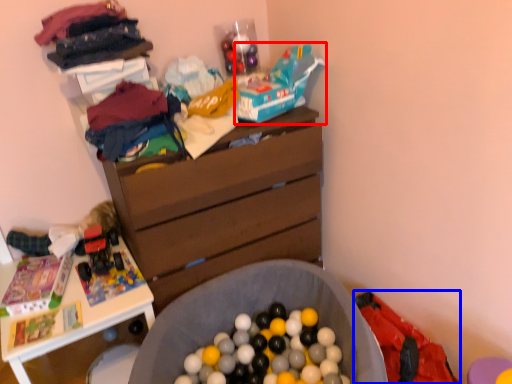
Question: Among these objects, which one is farthest to the camera, toy car (highlighted by a red box) or underclothes (highlighted by a blue box)?

Choices:
 (A) toy car
 (B) underclothes

Answer: (A)